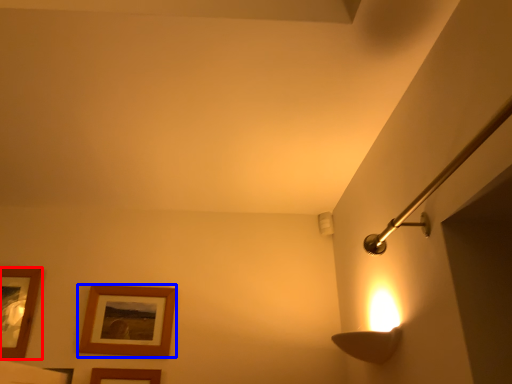
Question: Among these objects, which one is farthest to the camera, picture frame (highlighted by a red box) or picture frame (highlighted by a blue box)?

Choices:
 (A) picture frame
 (B) picture frame

Answer: (B)